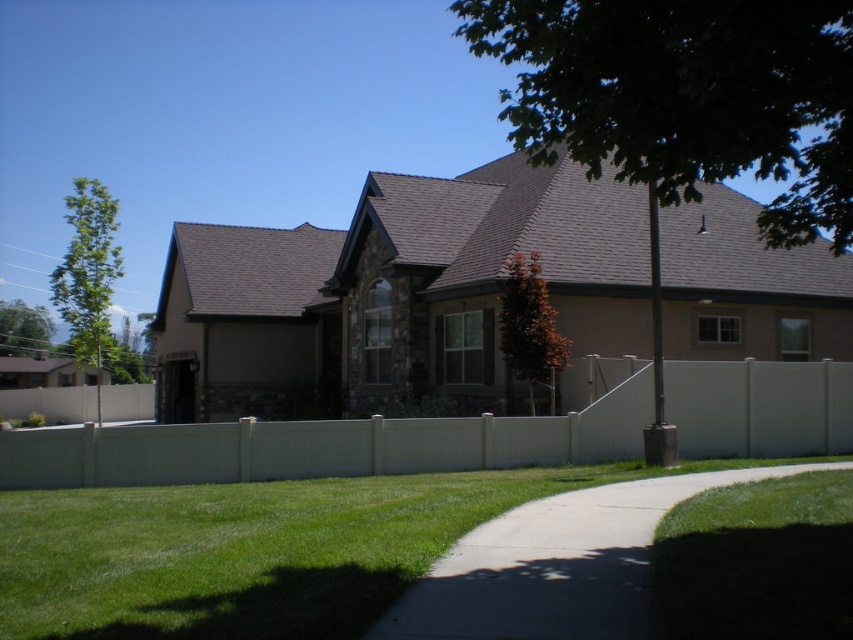
Question: Does green grass at lower left have a smaller size compared to white vinyl fence at center?

Choices:
 (A) no
 (B) yes

Answer: (B)

Question: Among these objects, which one is farthest from the camera?

Choices:
 (A) white vinyl fence at center
 (B) green grass at lower left

Answer: (A)

Question: Which point appears farthest from the camera in this image?

Choices:
 (A) (299, 570)
 (B) (215, 483)

Answer: (B)

Question: In this image, where is green grass at lower left located relative to white vinyl fence at center?

Choices:
 (A) right
 (B) left

Answer: (B)

Question: Can you confirm if green grass at lower left is positioned above white vinyl fence at center?

Choices:
 (A) yes
 (B) no

Answer: (B)

Question: Among these points, which one is nearest to the camera?

Choices:
 (A) (451, 468)
 (B) (115, 628)

Answer: (B)